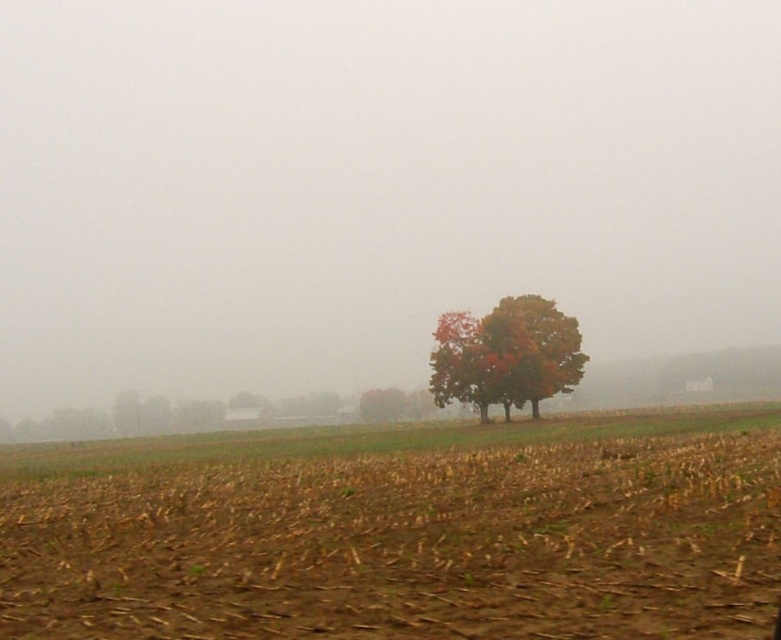
You are a farmer checking your field in the morning. You notice the brown soil at lower center and the autumn leaves tree at center. Which object is closer to you as you stand at the edge of the field?

The brown soil at lower center is closer to you because it is in front of the autumn leaves tree at center.

You are a farmer assessing the field. You notice the brown soil at lower center and the autumn leaves tree at center. Which object covers a larger area in the scene?

The brown soil at lower center is bigger than the autumn leaves tree at center, so it covers a larger area in the scene.

You are a hiker who wants to take a photo of the autumn leaves tree at center. You are currently standing on the brown soil at lower center. To frame the tree properly, should you move to your left or right side?

The brown soil at lower center is positioned on the left side of autumn leaves tree at center. Therefore, to frame the autumn leaves tree at center properly, you should move to your right side so that the tree comes into view.